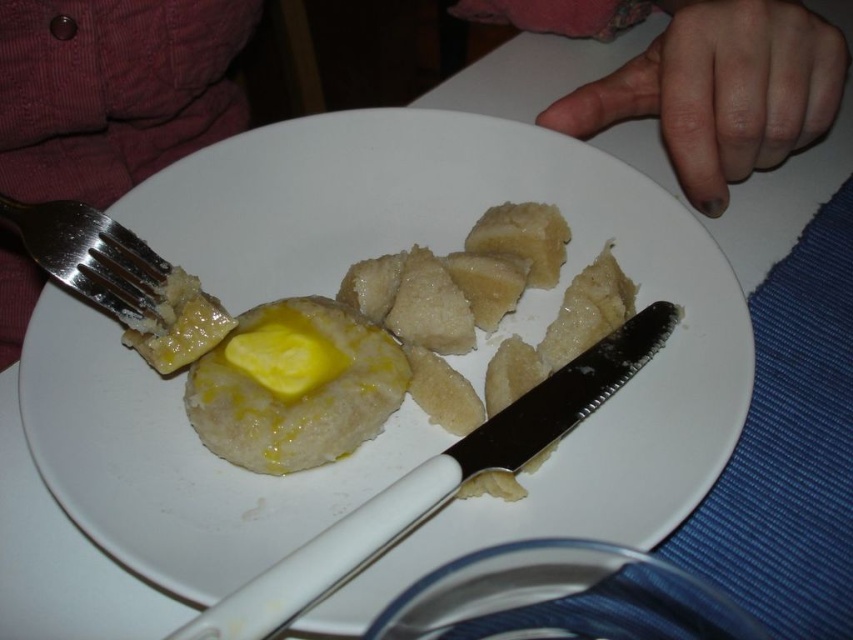
Question: Can you confirm if yellow buttery roll at center is thinner than silver metallic fork at upper left?

Choices:
 (A) yes
 (B) no

Answer: (B)

Question: Considering the real-world distances, which object is farthest from the white plastic knife at center?

Choices:
 (A) matte yellow butter at center
 (B) silver metallic fork at upper left

Answer: (A)

Question: Which point is closer to the camera?

Choices:
 (A) matte yellow butter at center
 (B) white matte plate at center
 (C) silver metallic fork at upper left

Answer: (B)

Question: Among these objects, which one is farthest from the camera?

Choices:
 (A) yellow buttery roll at center
 (B) white plastic knife at center
 (C) matte yellow butter at center

Answer: (C)

Question: Does yellow buttery roll at center have a lesser width compared to yellow buttery mashed potato at center?

Choices:
 (A) yes
 (B) no

Answer: (B)

Question: Does pink fabric at upper left come in front of yellow buttery mashed potato at center?

Choices:
 (A) yes
 (B) no

Answer: (B)